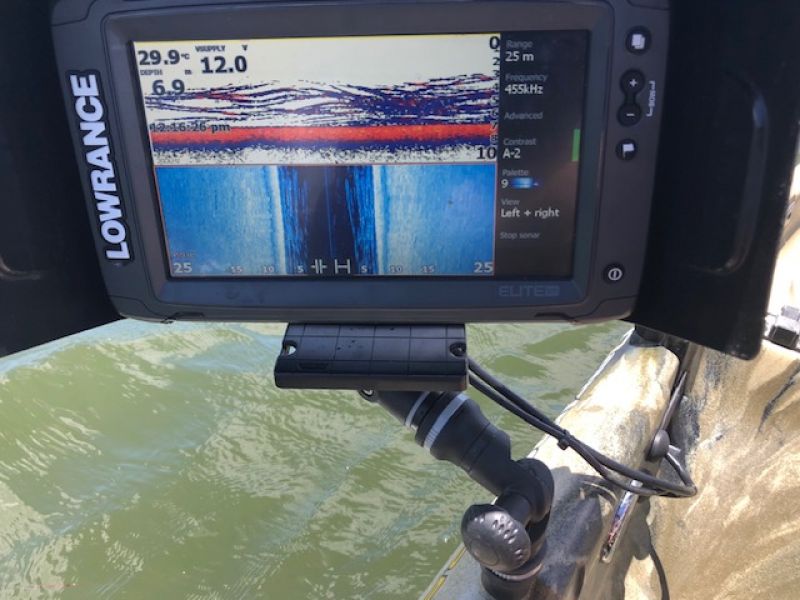
Identify the location of screen. This screenshot has width=800, height=600. (397, 181).